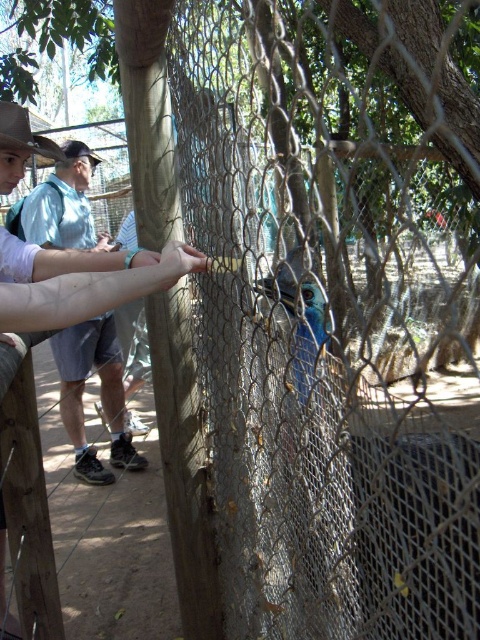
You are a zookeeper observing a cassowary enclosure. You notice a light blue shirt at center and a brown leather cowboy hat at upper left. Which object is located to the right of the other?

The light blue shirt at center is positioned on the right side of brown leather cowboy hat at upper left.

You are a zoo visitor looking at the enclosure with a large bird. You notice a light blue shirt at center and a brown leather cowboy hat at upper left. Which object is closer to the top of the image?

The brown leather cowboy hat at upper left is closer to the top of the image.

You are a zookeeper observing the cassowary enclosure. You notice a light blue shirt at center and a smooth skin hand at center near the fence. Which object is narrower?

The light blue shirt at center is narrower than the smooth skin hand at center.